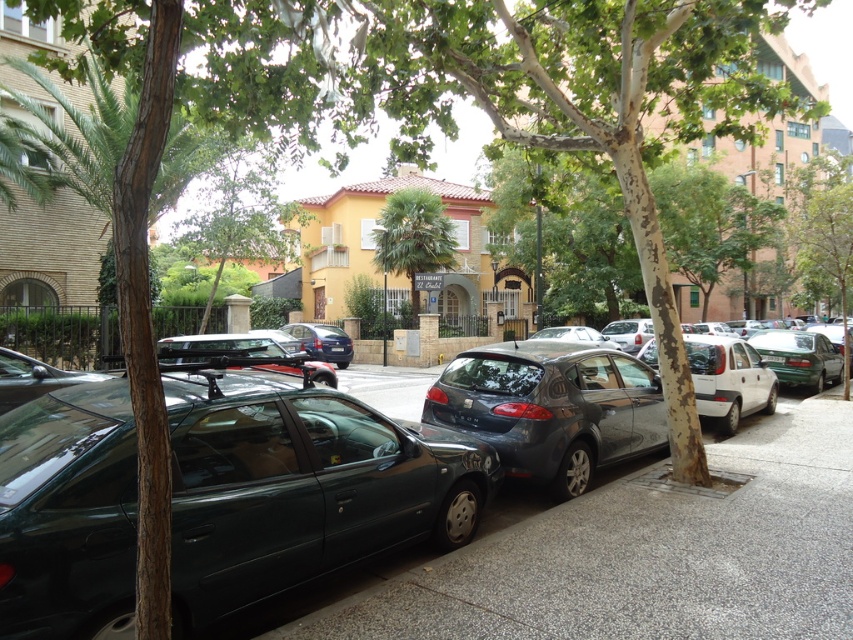
You are a delivery person trying to park your van in this residential area. You see the gray concrete pavement at center and the shiny blue sedan at center. Which area is more accessible for parking your van?

The gray concrete pavement at center is closer to the viewer than the shiny blue sedan at center, so the gray concrete pavement at center is more accessible for parking the van.